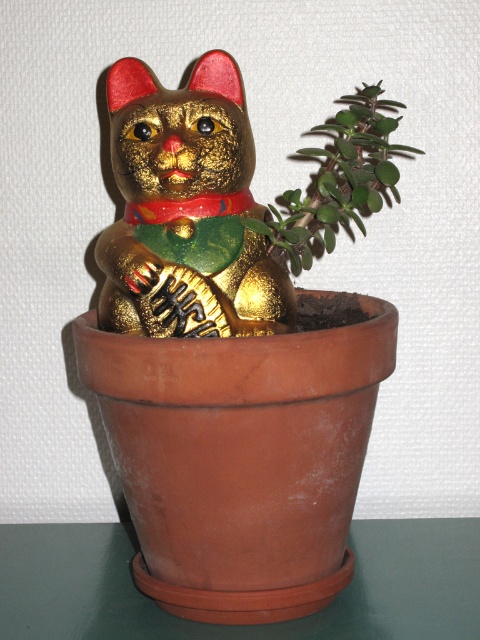
Question: Is gold glitter cat at center smaller than green succulent at upper right?

Choices:
 (A) yes
 (B) no

Answer: (A)

Question: Is gold glitter cat at center positioned in front of green succulent at upper right?

Choices:
 (A) yes
 (B) no

Answer: (A)

Question: Which of the following is the farthest from the observer?

Choices:
 (A) green succulent at upper right
 (B) gold glitter cat at center

Answer: (A)

Question: Is gold glitter cat at center further to the viewer compared to green succulent at upper right?

Choices:
 (A) yes
 (B) no

Answer: (B)

Question: Which object is farther from the camera taking this photo?

Choices:
 (A) green succulent at upper right
 (B) gold glitter cat at center

Answer: (A)